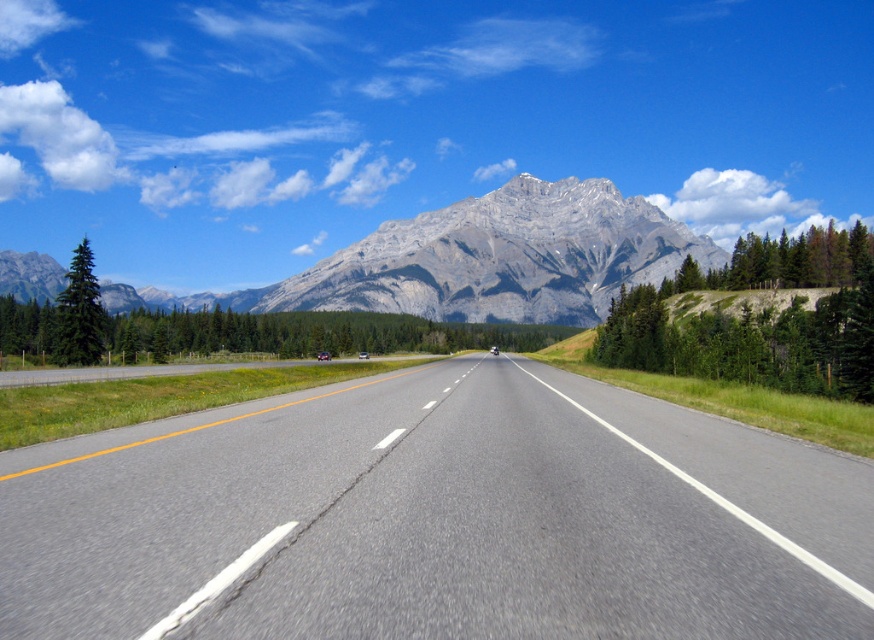
Is asphalt road at center to the right of green textured tree at right from the viewer's perspective?

In fact, asphalt road at center is to the left of green textured tree at right.

Which is more to the right, asphalt road at center or green textured tree at right?

green textured tree at right

Identify the location of asphalt road at center. (437, 518).

Where is `asphalt road at center`? asphalt road at center is located at coordinates (437, 518).

Can you confirm if gray rocky mountain at center is thinner than green matte tree at left?

No.

Does point (472, 236) lie in front of point (82, 257)?

No, it is not.

Locate an element on the screen. The image size is (874, 640). gray rocky mountain at center is located at coordinates (503, 257).

Between asphalt road at center and green leafy tree at left, which one has less height?

asphalt road at center

Is asphalt road at center to the right of green leafy tree at left from the viewer's perspective?

Yes, asphalt road at center is to the right of green leafy tree at left.

What do you see at coordinates (437, 518) in the screenshot?
I see `asphalt road at center` at bounding box center [437, 518].

At what (x,y) coordinates should I click in order to perform the action: click on asphalt road at center. Please return your answer as a coordinate pair (x, y). The height and width of the screenshot is (640, 874). Looking at the image, I should click on (437, 518).